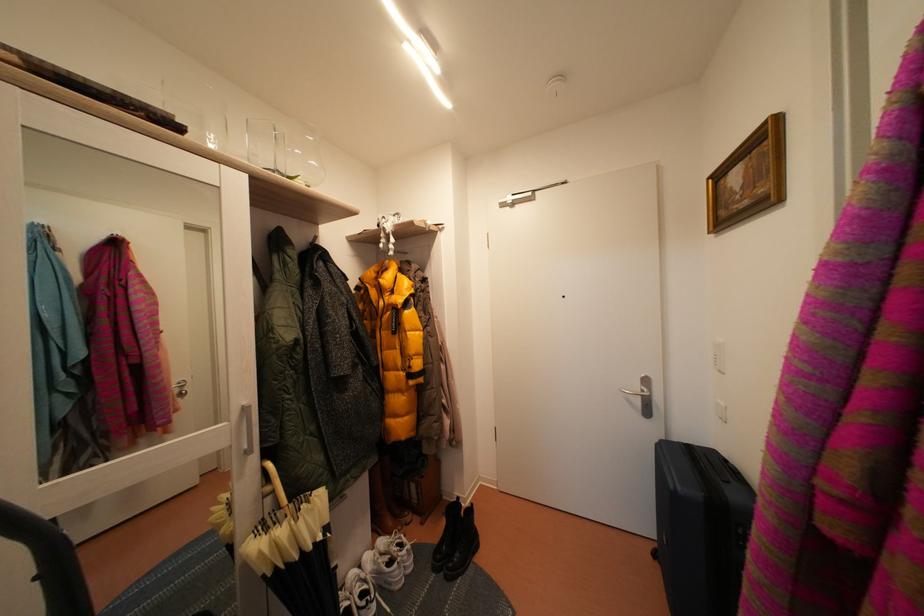
Locate an element on the screen. silver wall hook is located at coordinates (313, 237).